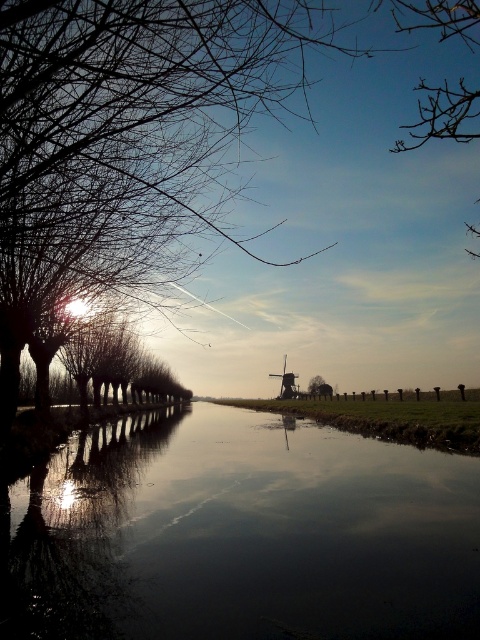
Is bare branches at left to the right of bare branches at upper right from the viewer's perspective?

In fact, bare branches at left is to the left of bare branches at upper right.

From the picture: Does bare branches at left lie in front of bare branches at upper right?

Yes, it is.

Locate an element on the screen. This screenshot has height=640, width=480. bare branches at left is located at coordinates coord(137,100).

The image size is (480, 640). I want to click on bare branches at left, so click(x=137, y=100).

Consider the image. Is dark reflective water at center closer to the viewer compared to bare branches at left?

No.

Can you confirm if dark reflective water at center is shorter than bare branches at left?

Yes, dark reflective water at center is shorter than bare branches at left.

Find the location of a particular element. Image resolution: width=480 pixels, height=640 pixels. dark reflective water at center is located at coordinates (240, 532).

Image resolution: width=480 pixels, height=640 pixels. I want to click on dark reflective water at center, so click(240, 532).

Consider the image. Who is higher up, bare branches at left or wooden windmill at center?

bare branches at left is higher up.

Does bare branches at left appear on the right side of wooden windmill at center?

No, bare branches at left is not to the right of wooden windmill at center.

Who is more distant from viewer, (218, 38) or (282, 374)?

The point (282, 374) is behind.

I want to click on bare branches at left, so click(137, 100).